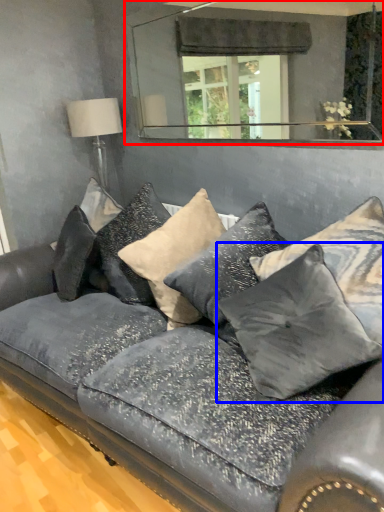
Question: Which object is closer to the camera taking this photo, mirror (highlighted by a red box) or pillow (highlighted by a blue box)?

Choices:
 (A) mirror
 (B) pillow

Answer: (B)